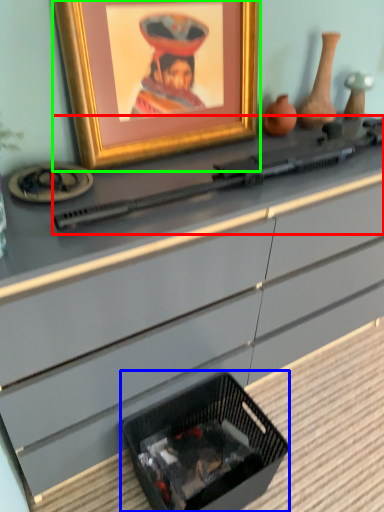
Question: Estimate the real-world distances between objects in this image. Which object is closer to weapon (highlighted by a red box), basket (highlighted by a blue box) or picture frame (highlighted by a green box)?

Choices:
 (A) basket
 (B) picture frame

Answer: (B)